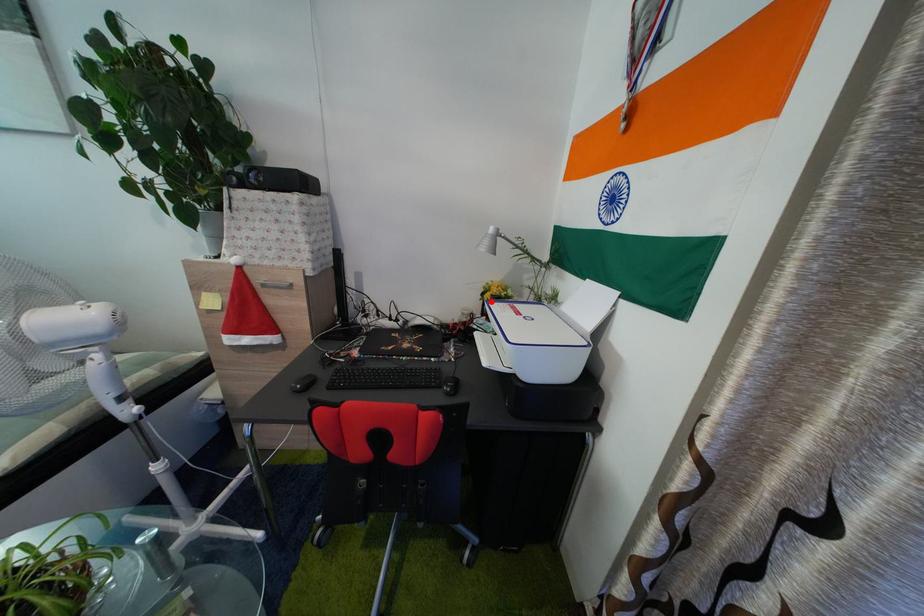
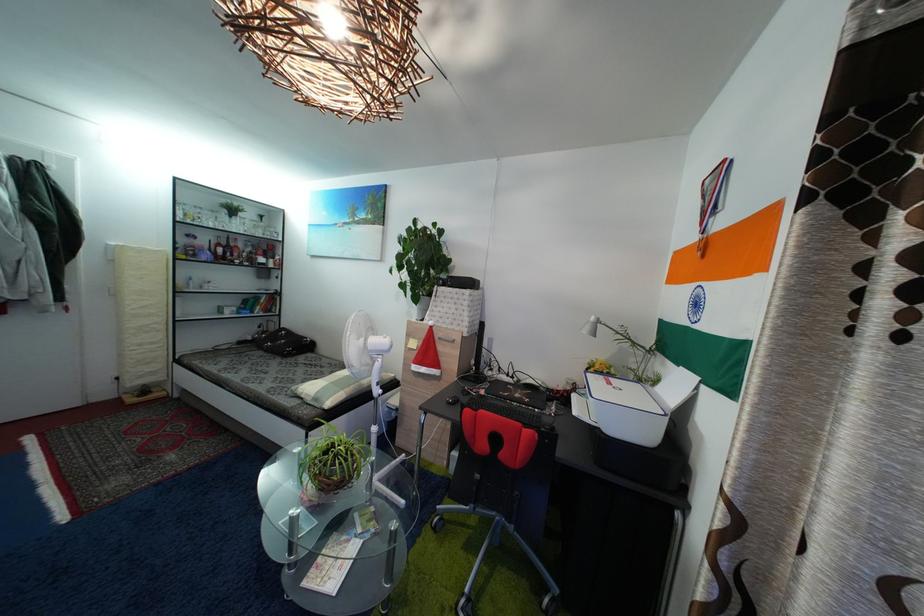
Find the pixel in the second image that matches the highlighted location in the first image.

(596, 377)